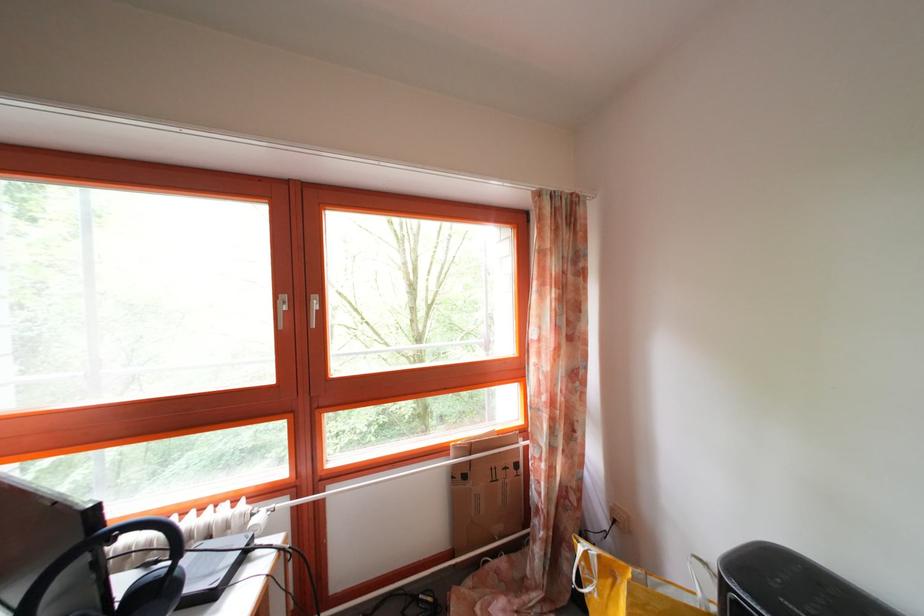
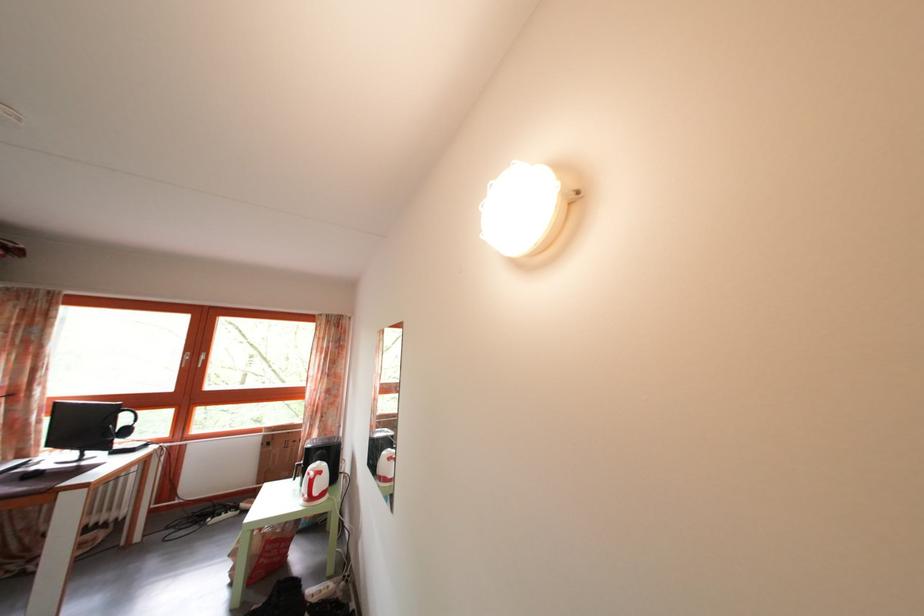
The point at [299,310] is marked in the first image. Where is the corresponding point in the second image?

(199, 363)